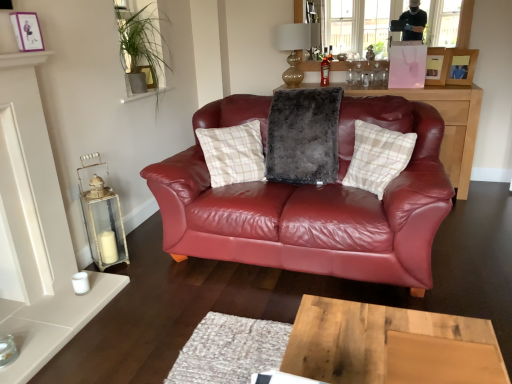
This screenshot has width=512, height=384. Find the location of `free space above wooden desk at center (from a real-world perspective)`. free space above wooden desk at center (from a real-world perspective) is located at coordinates (385, 345).